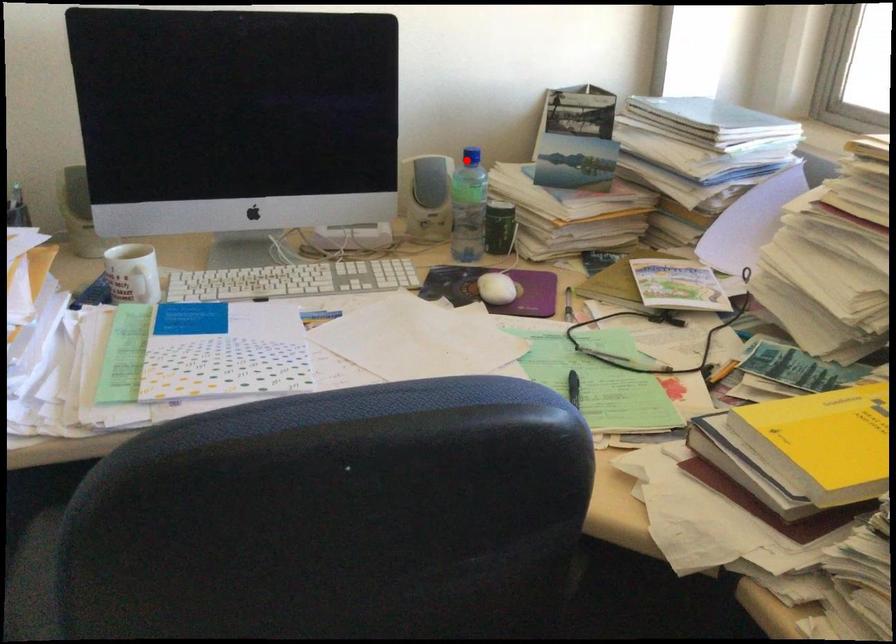
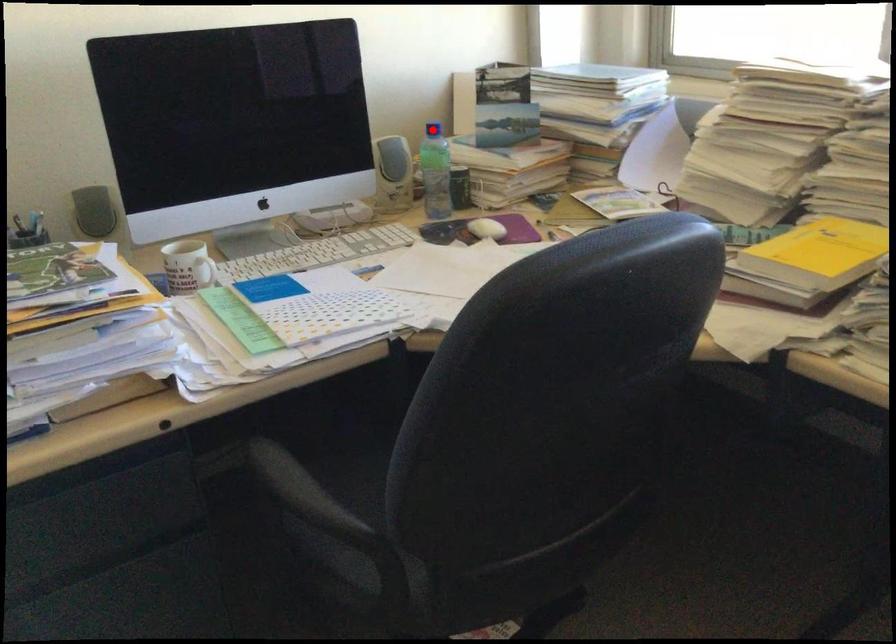
I am providing you with two images of the same scene from different viewpoints. A red point is marked on the first image and another point is marked on the second image. Do the highlighted points in image1 and image2 indicate the same real-world spot?

Yes